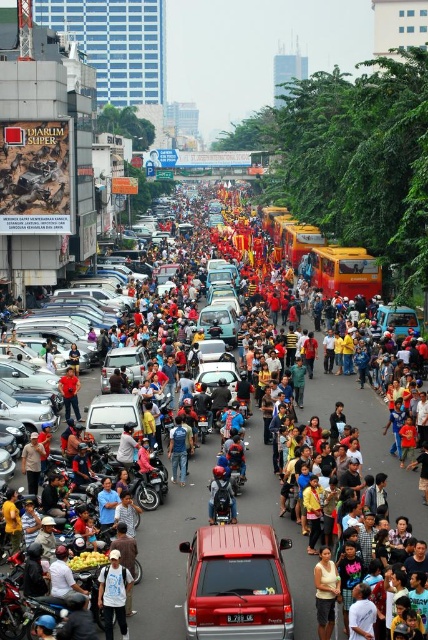
Question: Does silver metallic van at center appear over matte silver car at center?

Choices:
 (A) no
 (B) yes

Answer: (A)

Question: Estimate the real-world distances between objects in this image. Which object is closer to the silver metallic van at center?

Choices:
 (A) yellow fabric shirt at center
 (B) shiny black motorcycle at center
 (C) matte silver car at center
 (D) blue jeans at center

Answer: (D)

Question: Is matte silver car at center to the left of shiny black motorcycle at center from the viewer's perspective?

Choices:
 (A) no
 (B) yes

Answer: (B)

Question: Which of the following is the farthest from the observer?

Choices:
 (A) (140, 376)
 (B) (272, 323)
 (C) (107, 426)
 (D) (222, 545)

Answer: (B)

Question: Estimate the real-world distances between objects in this image. Which object is closer to the yellow fabric shirt at center?

Choices:
 (A) matte silver car at center
 (B) metallic red van at center
 (C) blue jeans at center

Answer: (B)

Question: From the image, what is the correct spatial relationship of metallic red van at center in relation to shiny black motorcycle at center?

Choices:
 (A) above
 (B) below

Answer: (B)